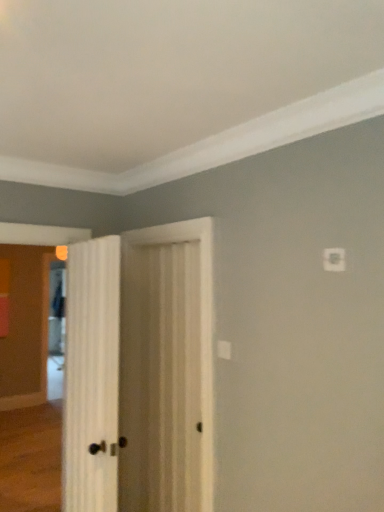
Question: Are white wood door at center, which is the second door in right-to-left order, and clear glass screen door at left located far from each other?

Choices:
 (A) no
 (B) yes

Answer: (B)

Question: Is white wood door at center, arranged as the first door when viewed from the left, positioned beyond the bounds of clear glass screen door at left?

Choices:
 (A) yes
 (B) no

Answer: (A)

Question: From the image's perspective, is white wood door at center, arranged as the first door when viewed from the left, under clear glass screen door at left?

Choices:
 (A) no
 (B) yes

Answer: (A)

Question: Considering the relative positions of white wood door at center, which is the second door in right-to-left order, and clear glass screen door at left in the image provided, is white wood door at center, which is the second door in right-to-left order, to the left of clear glass screen door at left from the viewer's perspective?

Choices:
 (A) no
 (B) yes

Answer: (A)

Question: Can you confirm if white wood door at center, arranged as the first door when viewed from the left, is taller than clear glass screen door at left?

Choices:
 (A) yes
 (B) no

Answer: (B)

Question: Visually, is white wood door at center, which appears as the second door when viewed from the left, positioned to the left or to the right of clear glass screen door at left?

Choices:
 (A) left
 (B) right

Answer: (B)

Question: In terms of width, does white wood door at center, which appears as the second door when viewed from the left, look wider or thinner when compared to clear glass screen door at left?

Choices:
 (A) thin
 (B) wide

Answer: (A)

Question: From a real-world perspective, is white wood door at center, which is the 1th door in right-to-left order, positioned above or below clear glass screen door at left?

Choices:
 (A) below
 (B) above

Answer: (B)

Question: Is point (147, 388) closer or farther from the camera than point (52, 386)?

Choices:
 (A) farther
 (B) closer

Answer: (B)

Question: In the image, is clear glass screen door at left on the left side or the right side of white wood door at center, which is the 1th door in right-to-left order?

Choices:
 (A) right
 (B) left

Answer: (B)

Question: Which is correct: clear glass screen door at left is inside white wood door at center, which is the 1th door in right-to-left order, or outside of it?

Choices:
 (A) inside
 (B) outside

Answer: (B)

Question: Relative to white wood door at center, which is the 1th door in right-to-left order, is clear glass screen door at left in front or behind?

Choices:
 (A) behind
 (B) front

Answer: (A)

Question: Is clear glass screen door at left taller or shorter than white wood door at center, which is the 1th door in right-to-left order?

Choices:
 (A) tall
 (B) short

Answer: (A)

Question: In the image, is white wood door at center, arranged as the first door when viewed from the left, positioned in front of or behind clear glass screen door at left?

Choices:
 (A) behind
 (B) front

Answer: (B)

Question: Is white wood door at center, arranged as the first door when viewed from the left, inside the boundaries of clear glass screen door at left, or outside?

Choices:
 (A) inside
 (B) outside

Answer: (B)